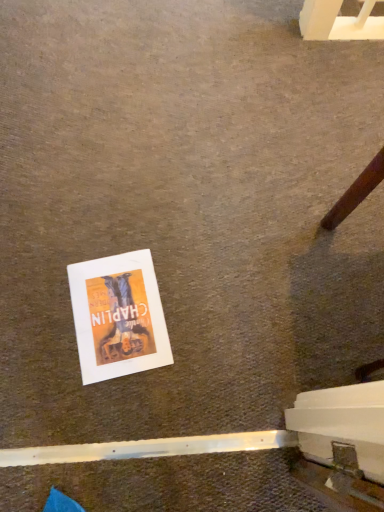
Measure the distance between matte paper poster at lower left and camera.

The depth of matte paper poster at lower left is 38.73 inches.

Describe the element at coordinates (118, 316) in the screenshot. I see `matte paper poster at lower left` at that location.

Locate an element on the screen. Image resolution: width=384 pixels, height=512 pixels. matte paper poster at lower left is located at coordinates (118, 316).

The height and width of the screenshot is (512, 384). Identify the location of matte paper poster at lower left. (118, 316).